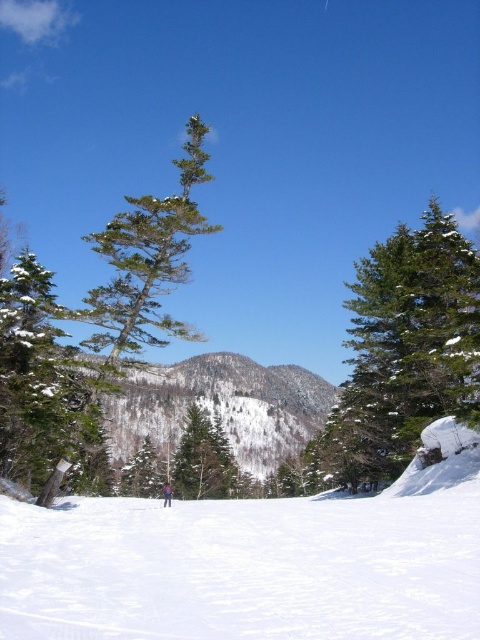
Question: Is white snow ski slope at lower center below green matte tree at center?

Choices:
 (A) yes
 (B) no

Answer: (B)

Question: Which of the following is the closest to the observer?

Choices:
 (A) green matte tree at center
 (B) green textured pine tree at right

Answer: (B)

Question: Which of the following is the closest to the observer?

Choices:
 (A) (206, 470)
 (B) (363, 637)
 (C) (352, 330)

Answer: (B)

Question: Which point appears farthest from the camera in this image?

Choices:
 (A) (419, 428)
 (B) (93, 410)

Answer: (B)

Question: Does white snow ski slope at lower center have a smaller size compared to green textured pine tree at right?

Choices:
 (A) no
 (B) yes

Answer: (B)

Question: Can you confirm if white snow ski slope at lower center is positioned to the left of green matte tree at left?

Choices:
 (A) yes
 (B) no

Answer: (B)